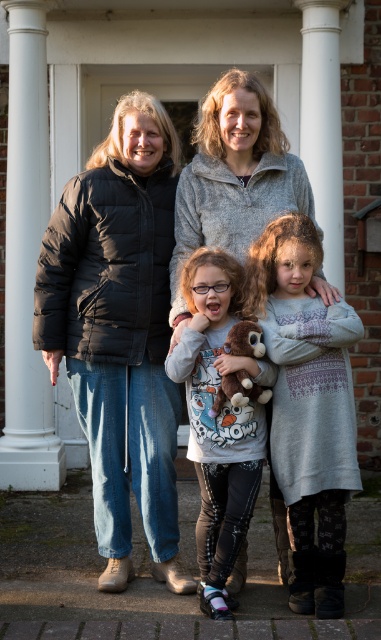
Question: Which point is closer to the camera?

Choices:
 (A) (81, 360)
 (B) (200, 216)

Answer: (A)

Question: Is matte gray sweater at center smaller than brown plush toy at center?

Choices:
 (A) no
 (B) yes

Answer: (A)

Question: Is grey knit dress at center behind matte black jacket at left?

Choices:
 (A) yes
 (B) no

Answer: (B)

Question: Which point appears closest to the camera in this image?

Choices:
 (A) (235, 428)
 (B) (158, 150)
 (C) (225, 392)

Answer: (C)

Question: Does black puffer jacket at center appear over matte black jacket at left?

Choices:
 (A) yes
 (B) no

Answer: (B)

Question: Which is farther from the grey knit dress at center?

Choices:
 (A) brown plush toy at center
 (B) matte black jacket at left
 (C) black puffer jacket at center
 (D) matte gray sweater at center

Answer: (C)